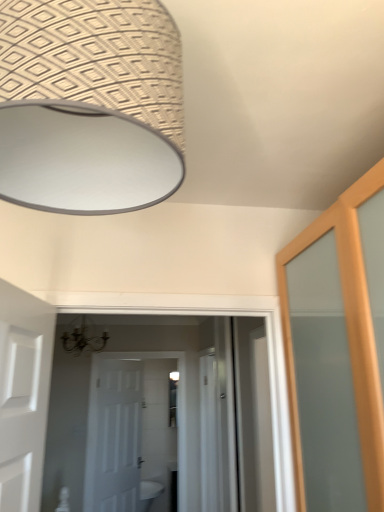
Question: Is white glossy screen door at center bigger or smaller than white matte door at center?

Choices:
 (A) small
 (B) big

Answer: (B)

Question: From the image's perspective, is white glossy screen door at center positioned above or below white matte door at center?

Choices:
 (A) below
 (B) above

Answer: (B)

Question: Estimate the real-world distances between objects in this image. Which object is closer to the white glossy sink at lower center?

Choices:
 (A) white matte door at center
 (B) white glossy screen door at center

Answer: (A)

Question: Which object is positioned closest to the white matte door at center?

Choices:
 (A) white glossy sink at lower center
 (B) white glossy screen door at center

Answer: (A)